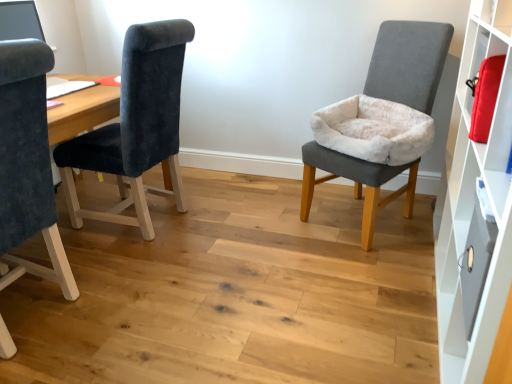
Where is `blank area to the left of velvet gray chair at right, acting as the third chair starting from the left`? This screenshot has height=384, width=512. blank area to the left of velvet gray chair at right, acting as the third chair starting from the left is located at coordinates click(273, 223).